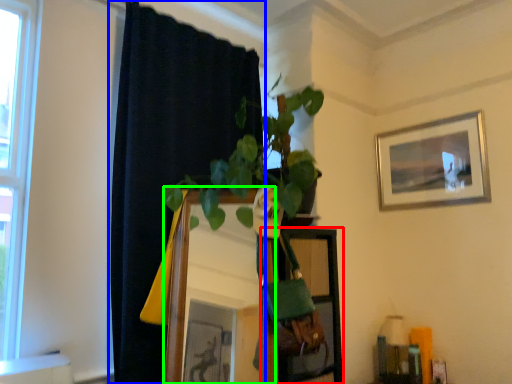
Question: Considering the real-world distances, which object is farthest from shelf (highlighted by a red box)? curtain (highlighted by a blue box) or mirror (highlighted by a green box)?

Choices:
 (A) curtain
 (B) mirror

Answer: (A)